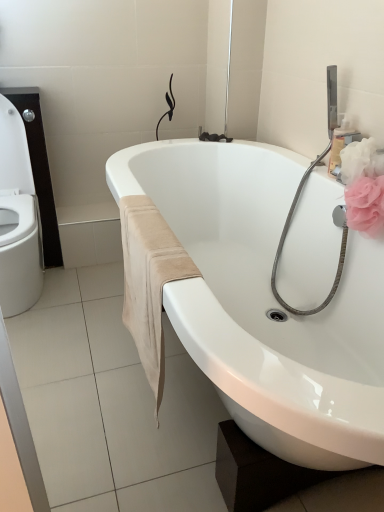
Identify the location of free space to the left of black rubber faucet at upper center. (186, 145).